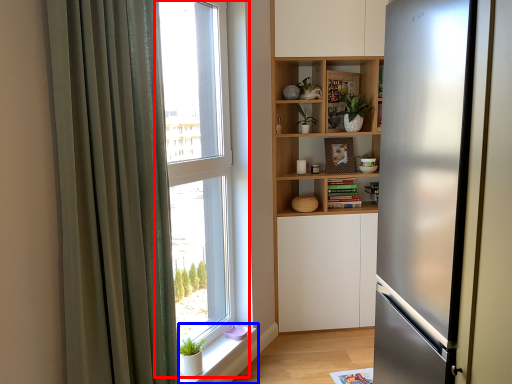
Question: Which of the following is the farthest to the observer, window (highlighted by a red box) or window sill (highlighted by a blue box)?

Choices:
 (A) window
 (B) window sill

Answer: (B)